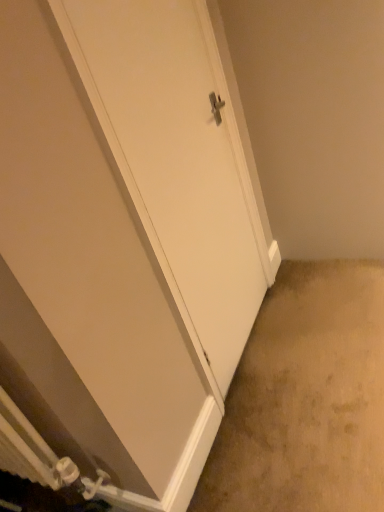
Question: From a real-world perspective, is beige carpet at lower right positioned above or below white matte door at center?

Choices:
 (A) above
 (B) below

Answer: (B)

Question: Is beige carpet at lower right bigger or smaller than white matte door at center?

Choices:
 (A) small
 (B) big

Answer: (B)

Question: Is beige carpet at lower right situated inside white matte door at center or outside?

Choices:
 (A) outside
 (B) inside

Answer: (A)

Question: From a real-world perspective, relative to beige carpet at lower right, is white matte door at center vertically above or below?

Choices:
 (A) below
 (B) above

Answer: (B)

Question: From the image's perspective, is white matte door at center positioned above or below beige carpet at lower right?

Choices:
 (A) below
 (B) above

Answer: (B)

Question: Looking at the image, does white matte door at center seem bigger or smaller compared to beige carpet at lower right?

Choices:
 (A) small
 (B) big

Answer: (A)

Question: Is point click(198, 286) positioned closer to the camera than point click(337, 349)?

Choices:
 (A) closer
 (B) farther

Answer: (A)